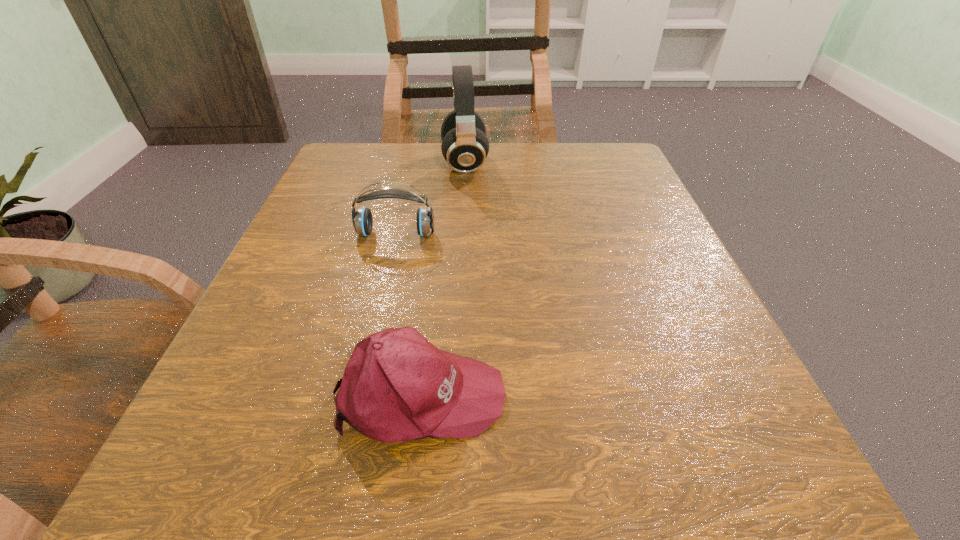
This screenshot has width=960, height=540. Identify the location of vacant area that lies between the farthest object and the nearer headset. coord(430,199).

This screenshot has width=960, height=540. What are the coordinates of `free point between the nearest object and the taller headset` in the screenshot? It's located at (443, 279).

I want to click on free space that is in between the nearer headset and the nearest object, so (x=408, y=314).

The width and height of the screenshot is (960, 540). I want to click on vacant area that lies between the farthest object and the shorter headset, so click(430, 199).

The width and height of the screenshot is (960, 540). I want to click on free spot between the shorter headset and the farthest object, so tap(430, 199).

Where is `vacant space that is in between the nearer headset and the farthest object`? The height and width of the screenshot is (540, 960). vacant space that is in between the nearer headset and the farthest object is located at coordinates (430, 199).

Find the location of a particular element. Image resolution: width=960 pixels, height=540 pixels. vacant space in between the baseball cap and the farthest object is located at coordinates (443, 279).

Where is `vacant space that is in between the farthest object and the nearest object`? The width and height of the screenshot is (960, 540). vacant space that is in between the farthest object and the nearest object is located at coordinates (443, 279).

Where is `free point between the shorter headset and the tallest object`? The image size is (960, 540). free point between the shorter headset and the tallest object is located at coordinates (430, 199).

Image resolution: width=960 pixels, height=540 pixels. I want to click on free spot between the shorter headset and the taller headset, so click(x=430, y=199).